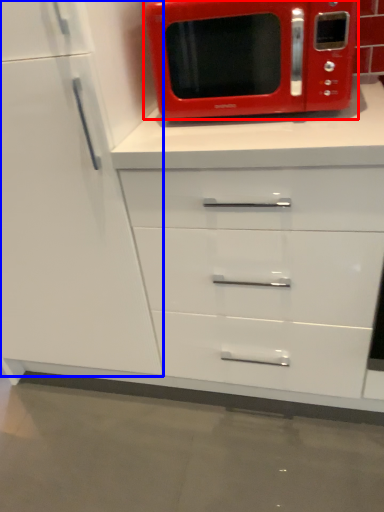
Question: Among these objects, which one is farthest to the camera, microwave oven (highlighted by a red box) or cabinetry (highlighted by a blue box)?

Choices:
 (A) microwave oven
 (B) cabinetry

Answer: (A)